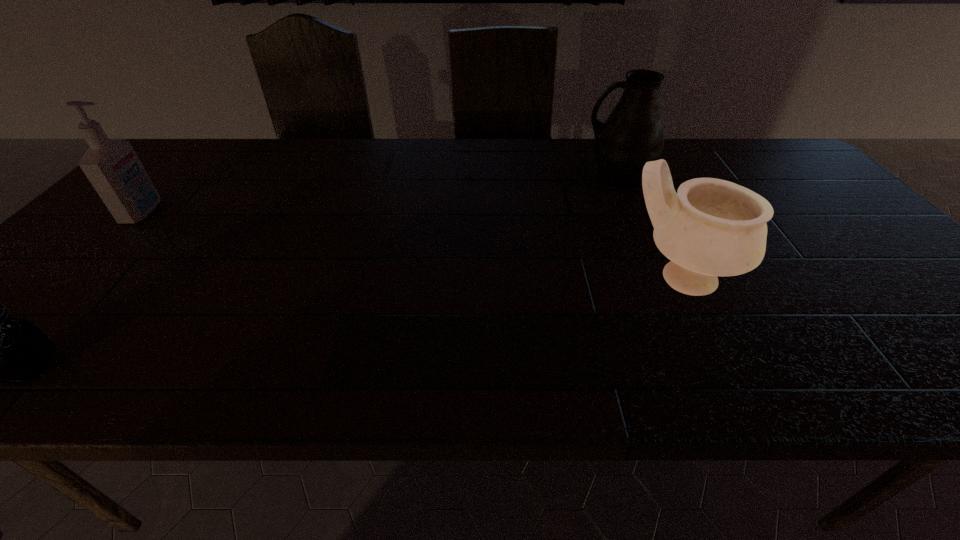
Find the location of a particular element. object located in the left edge section of the desktop is located at coordinates (113, 168).

Where is `free region at the far edge of the desktop`? Image resolution: width=960 pixels, height=540 pixels. free region at the far edge of the desktop is located at coordinates (449, 165).

Where is `free space at the near edge`? free space at the near edge is located at coordinates (634, 376).

The width and height of the screenshot is (960, 540). Identify the location of vacant space at the left edge of the desktop. click(x=108, y=249).

Locate an element on the screen. This screenshot has width=960, height=540. vacant space at the right edge of the desktop is located at coordinates (898, 261).

Identify the location of free space at the far left corner of the desktop. The width and height of the screenshot is (960, 540). (207, 165).

Locate an element on the screen. free space between the pitcher and the pottery is located at coordinates (648, 228).

Image resolution: width=960 pixels, height=540 pixels. I want to click on empty space between the farthest object and the cleansing agent, so tap(380, 196).

Identify the location of vacant point located between the farthest object and the third nearest object. Image resolution: width=960 pixels, height=540 pixels. (380, 196).

The image size is (960, 540). Identify the location of vacant area between the pottery and the second farthest object. (412, 245).